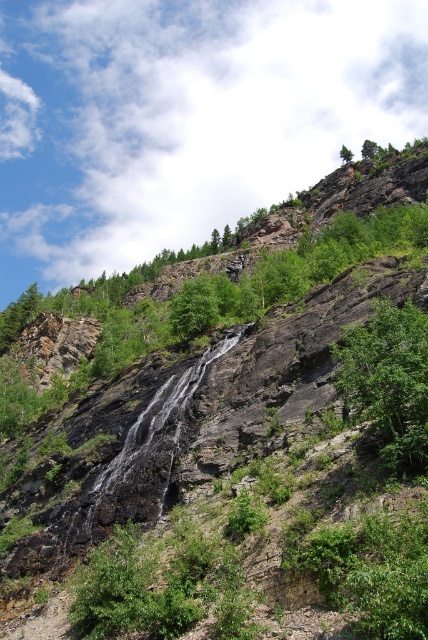
Question: Based on their relative distances, which object is nearer to the green leafy tree at upper center?

Choices:
 (A) green leafy tree at upper right
 (B) green leafy tree at center-right

Answer: (A)

Question: Is green leafy tree at upper center to the left of green leafy tree at upper right from the viewer's perspective?

Choices:
 (A) yes
 (B) no

Answer: (B)

Question: Which of the following is the closest to the observer?

Choices:
 (A) green leafy tree at center-right
 (B) green leafy tree at upper right
 (C) green leafy tree at upper center

Answer: (A)

Question: In this image, where is green leafy tree at center-right located relative to green leafy tree at upper center?

Choices:
 (A) left
 (B) right

Answer: (A)

Question: Which object is positioned closest to the green leafy tree at center-right?

Choices:
 (A) green leafy tree at upper right
 (B) green leafy tree at upper center

Answer: (B)

Question: Considering the relative positions of green leafy tree at center-right and green leafy tree at upper right in the image provided, where is green leafy tree at center-right located with respect to green leafy tree at upper right?

Choices:
 (A) above
 (B) below

Answer: (B)